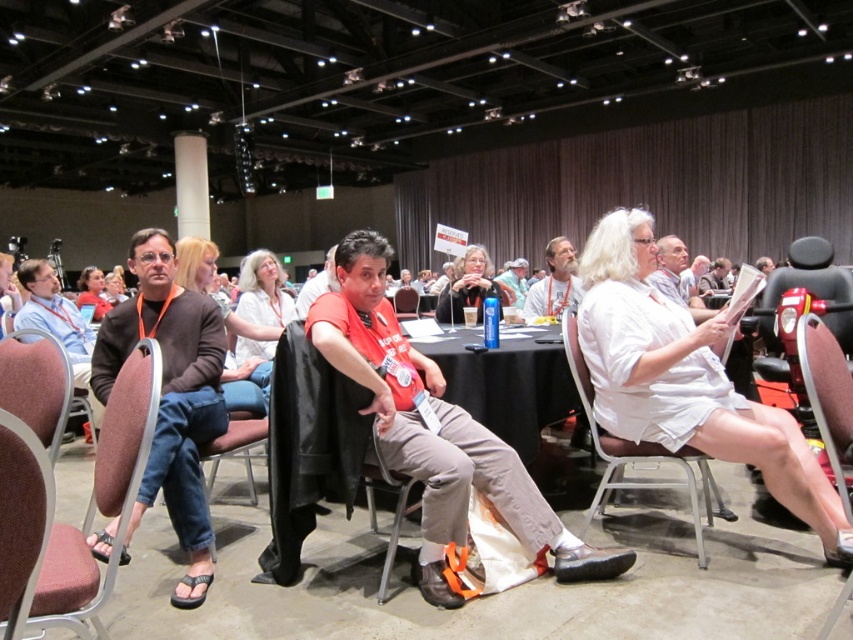
Question: Among these objects, which one is farthest from the camera?

Choices:
 (A) white plastic cup at center
 (B) brown fabric chair at left

Answer: (A)

Question: Is white paper at center behind brown fabric chair at center?

Choices:
 (A) no
 (B) yes

Answer: (A)

Question: Can you confirm if matte black jacket at upper left is positioned below white paper at center?

Choices:
 (A) no
 (B) yes

Answer: (B)

Question: Does brown cotton shirt at left have a smaller size compared to white paper at center?

Choices:
 (A) yes
 (B) no

Answer: (A)

Question: Which object is closer to the camera taking this photo?

Choices:
 (A) brown fabric chair at center
 (B) matte white shirt at center

Answer: (B)

Question: Among these objects, which one is farthest from the camera?

Choices:
 (A) brown fabric chair at center
 (B) white cotton shirt at center
 (C) bearded man at center

Answer: (A)